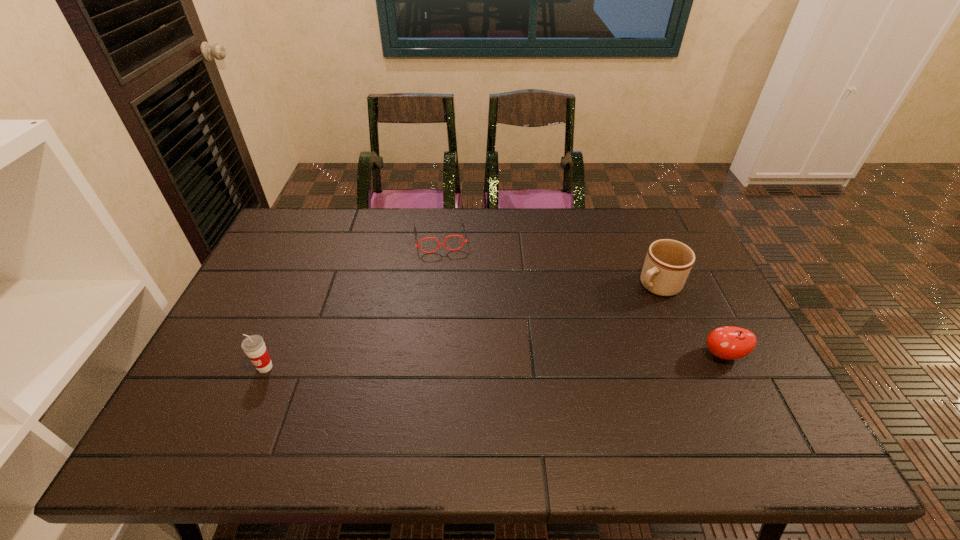
In the image, there is a desktop. At what (x,y) coordinates should I click in order to perform the action: click on blank space at the far left corner. Please return your answer as a coordinate pair (x, y). The height and width of the screenshot is (540, 960). Looking at the image, I should click on (296, 232).

In the image, there is a desktop. Identify the location of vacant space at the far right corner. The height and width of the screenshot is (540, 960). (644, 250).

Locate an element on the screen. The image size is (960, 540). free space between the farthest object and the apple is located at coordinates (582, 296).

Locate an element on the screen. free space between the shortest object and the mug is located at coordinates (548, 261).

The width and height of the screenshot is (960, 540). Identify the location of free space between the cup and the second object from left to right. (352, 302).

The width and height of the screenshot is (960, 540). Identify the location of vacant space that is in between the cup and the apple. (494, 361).

Locate an element on the screen. The height and width of the screenshot is (540, 960). empty space that is in between the second farthest object and the apple is located at coordinates (690, 320).

Identify the location of blank region between the apple and the mug. The height and width of the screenshot is (540, 960). tap(690, 320).

This screenshot has width=960, height=540. I want to click on free spot between the second farthest object and the apple, so click(690, 320).

The width and height of the screenshot is (960, 540). I want to click on free space between the spectacles and the cup, so coord(352,302).